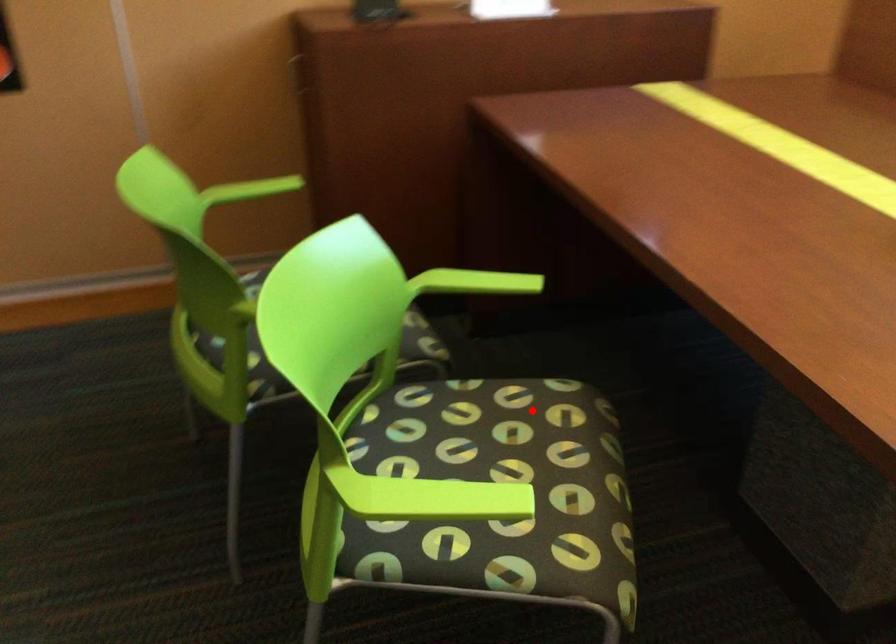
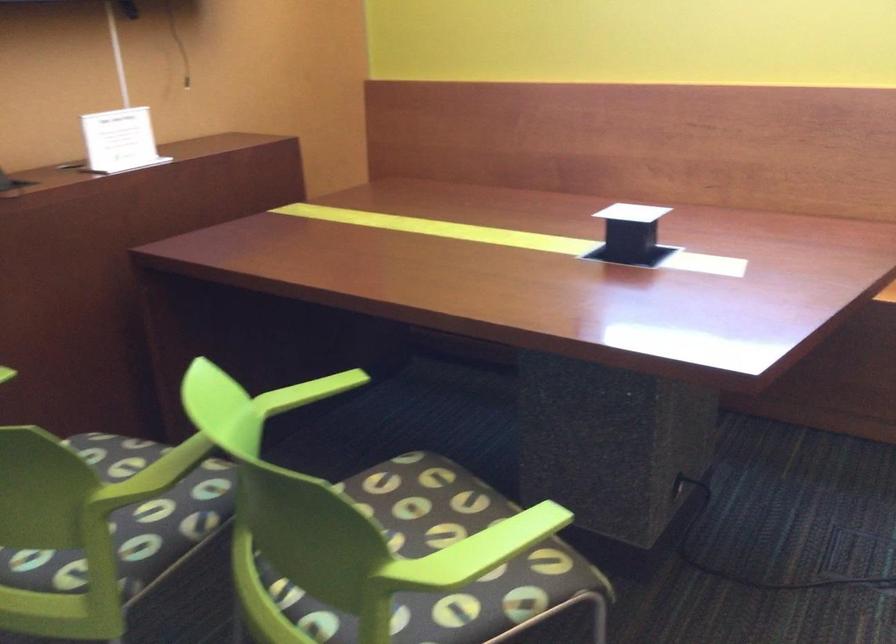
In the second image, find the point that corresponds to the highlighted location in the first image.

(403, 487)